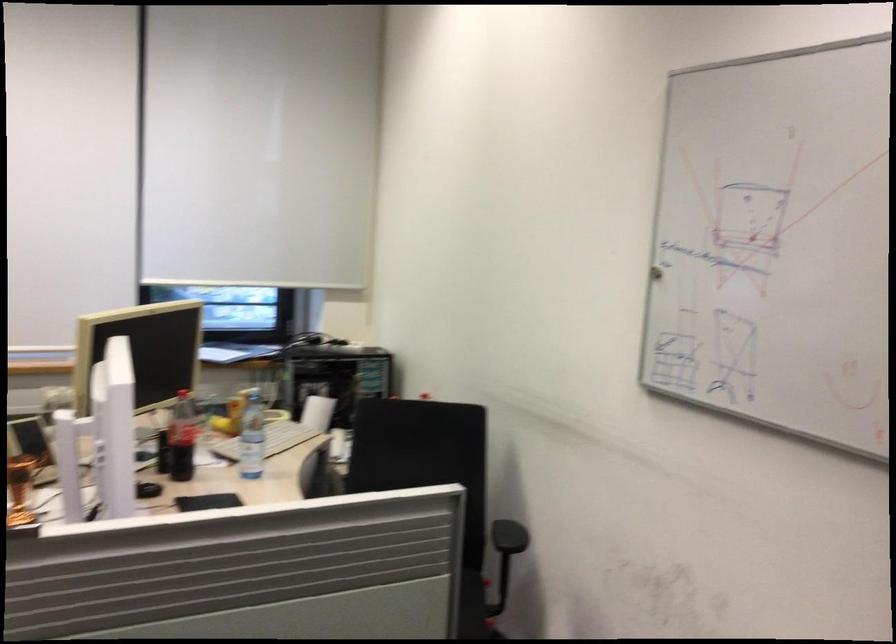
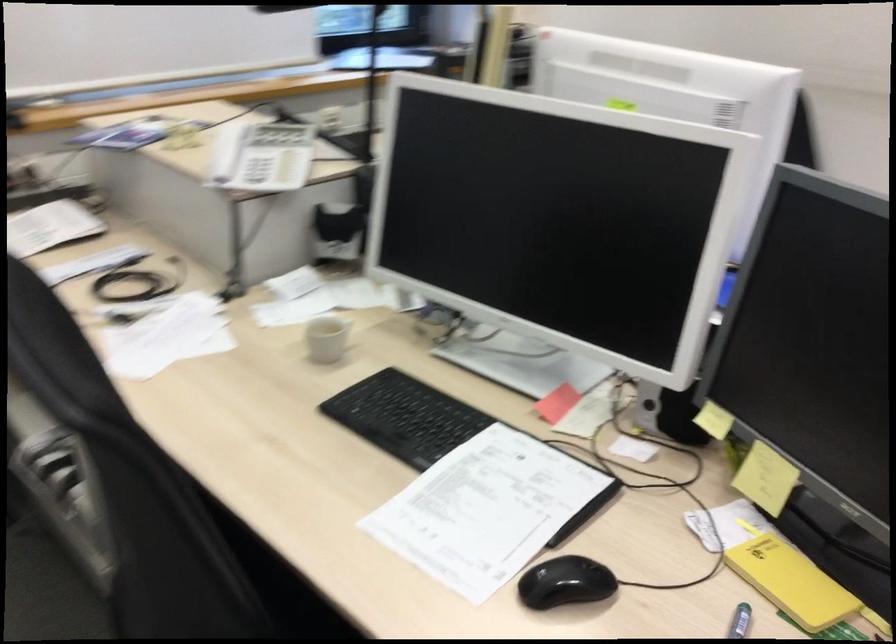
Question: In a continuous first-person perspective shot, in which direction is the camera moving?

Choices:
 (A) Left
 (B) Right
 (C) Forward
 (D) Backward

Answer: (A)